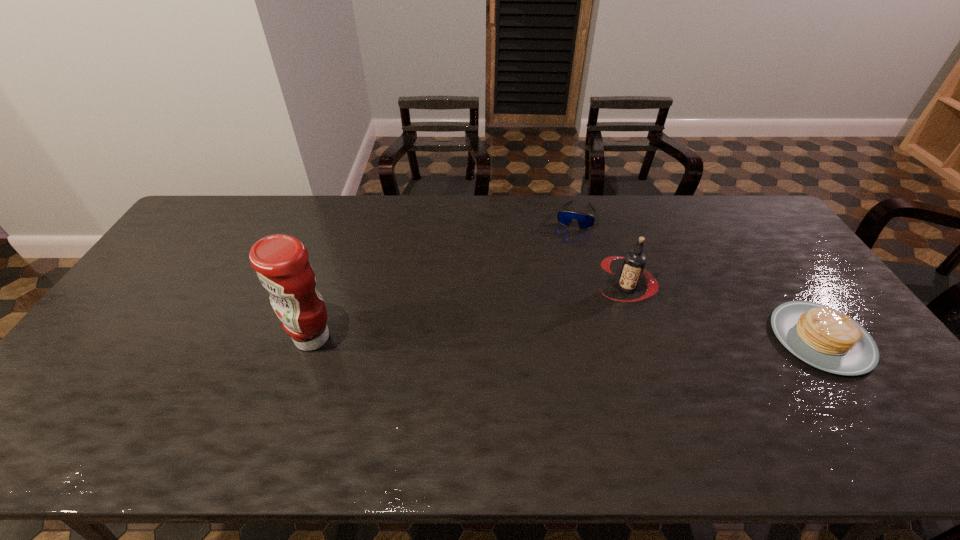
You are a GUI agent. You are given a task and a screenshot of the screen. Output one action in this format:
    pyautogui.click(x=<x>, y=<y>)
    Task: Click on the free space between the pancake and the third shortest object
    
    Given the screenshot: What is the action you would take?
    pyautogui.click(x=724, y=313)

I want to click on free space between the farthest object and the condiment, so 444,276.

You are a GUI agent. You are given a task and a screenshot of the screen. Output one action in this format:
    pyautogui.click(x=<x>, y=<y>)
    Task: Click on the second closest object to the rightmost object
    This screenshot has width=960, height=540.
    Given the screenshot: What is the action you would take?
    tap(585, 220)

Choose which object is the nearest neighbor to the farthest object. Please provide its 2D coordinates. Your answer should be formatted as a tuple, i.e. [(x, y)], where the tuple contains the x and y coordinates of a point satisfying the conditions above.

[(634, 262)]

Identify the location of vacant point that satisfies the following two spatial constraints: 1. on the front side of the pancake; 2. on the right side of the leftmost object. This screenshot has width=960, height=540. (312, 339).

Locate an element on the screen. Image resolution: width=960 pixels, height=540 pixels. vacant region that satisfies the following two spatial constraints: 1. on the back side of the condiment; 2. on the right side of the root beer is located at coordinates (329, 287).

The image size is (960, 540). I want to click on free space in the image that satisfies the following two spatial constraints: 1. on the front side of the leftmost object; 2. on the left side of the rightmost object, so click(312, 339).